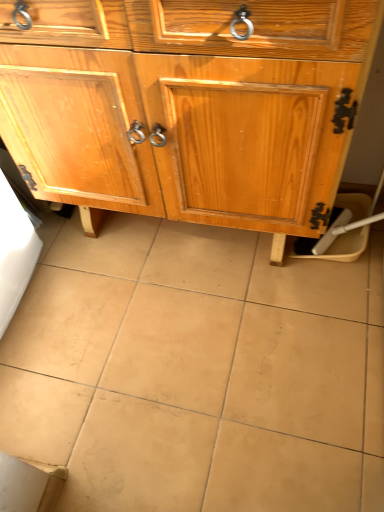
Question: Is wooden cabinet at center to the right of beige ceramic tile at center from the viewer's perspective?

Choices:
 (A) no
 (B) yes

Answer: (B)

Question: Could you tell me if wooden cabinet at center is facing beige ceramic tile at center?

Choices:
 (A) no
 (B) yes

Answer: (B)

Question: Would you say wooden cabinet at center contains beige ceramic tile at center?

Choices:
 (A) yes
 (B) no

Answer: (B)

Question: From the image's perspective, would you say wooden cabinet at center is positioned over beige ceramic tile at center?

Choices:
 (A) yes
 (B) no

Answer: (A)

Question: Can you confirm if wooden cabinet at center is smaller than beige ceramic tile at center?

Choices:
 (A) yes
 (B) no

Answer: (B)

Question: Does wooden cabinet at center have a larger size compared to beige ceramic tile at center?

Choices:
 (A) no
 (B) yes

Answer: (B)

Question: Is beige ceramic tile at center looking in the opposite direction of wooden cabinet at center?

Choices:
 (A) yes
 (B) no

Answer: (B)

Question: From the image's perspective, would you say beige ceramic tile at center is positioned over wooden cabinet at center?

Choices:
 (A) yes
 (B) no

Answer: (B)

Question: Considering the relative sizes of beige ceramic tile at center and wooden cabinet at center in the image provided, is beige ceramic tile at center wider than wooden cabinet at center?

Choices:
 (A) no
 (B) yes

Answer: (B)

Question: Is the position of beige ceramic tile at center more distant than that of wooden cabinet at center?

Choices:
 (A) no
 (B) yes

Answer: (B)

Question: Is beige ceramic tile at center taller than wooden cabinet at center?

Choices:
 (A) yes
 (B) no

Answer: (B)

Question: Is beige ceramic tile at center in front of wooden cabinet at center?

Choices:
 (A) yes
 (B) no

Answer: (B)

Question: Based on their positions, is beige ceramic tile at center located to the left or right of wooden cabinet at center?

Choices:
 (A) right
 (B) left

Answer: (B)